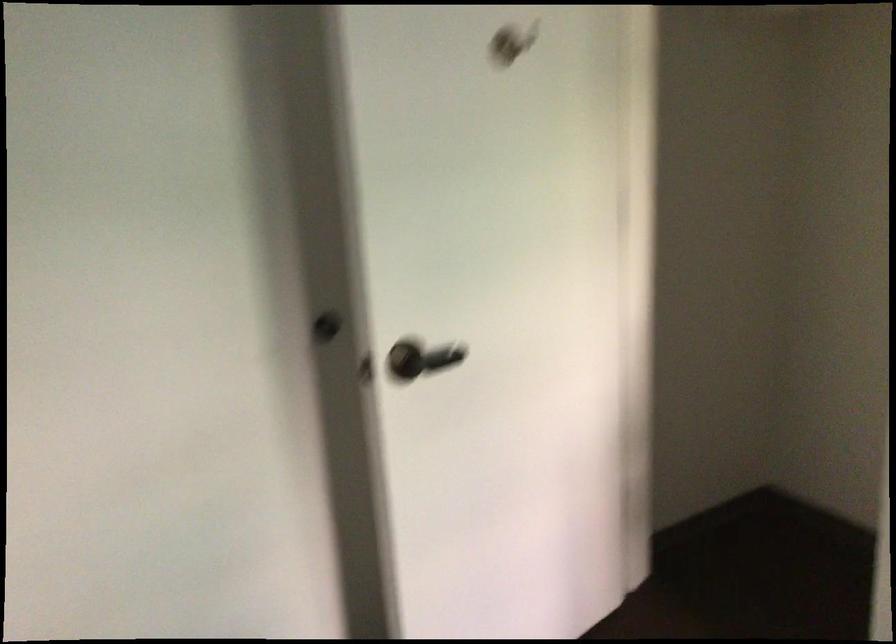
This screenshot has height=644, width=896. I want to click on dark door handle, so click(407, 359).